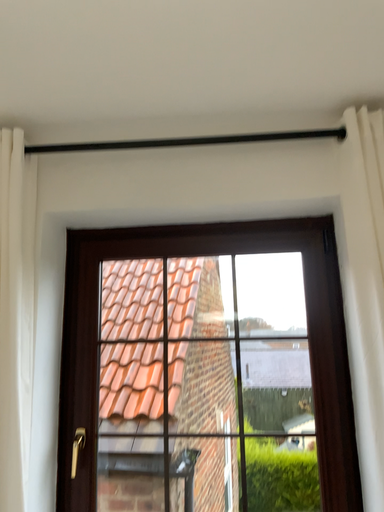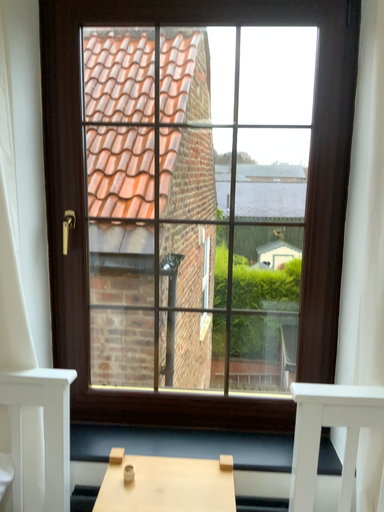
Question: Which way did the camera rotate in the video?

Choices:
 (A) rotated downward
 (B) rotated upward

Answer: (A)